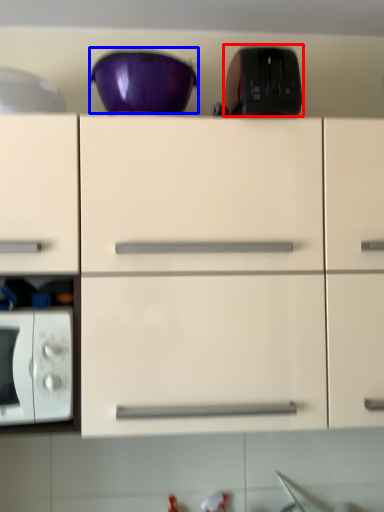
Question: Which object appears closest to the camera in this image, appliance (highlighted by a red box) or bowl (highlighted by a blue box)?

Choices:
 (A) appliance
 (B) bowl

Answer: (A)